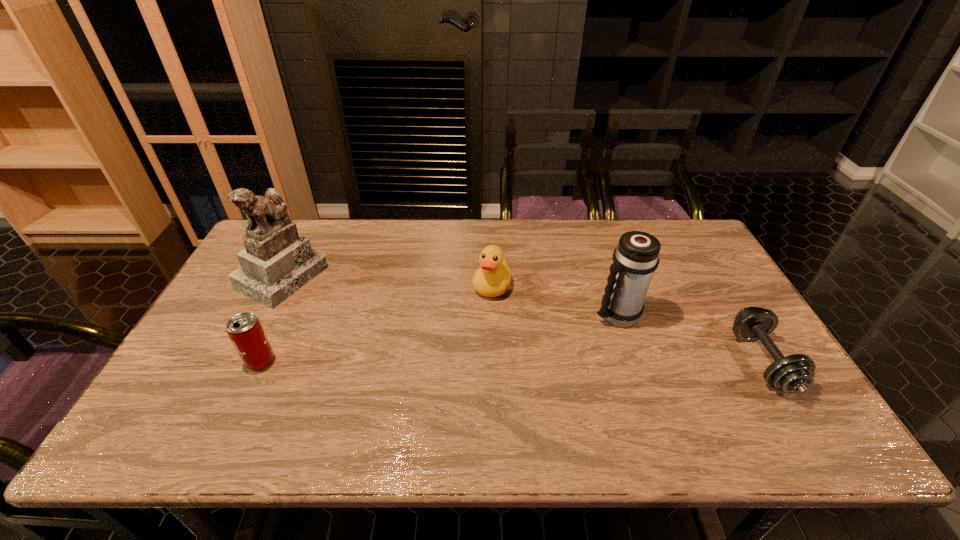
Locate an element on the screen. free location that satisfies the following two spatial constraints: 1. on the front side of the figurine; 2. on the left side of the shortest object is located at coordinates (239, 361).

At what (x,y) coordinates should I click in order to perform the action: click on blank area in the image that satisfies the following two spatial constraints: 1. on the front side of the beer can; 2. on the left side of the dumbbell. Please return your answer as a coordinate pair (x, y). The height and width of the screenshot is (540, 960). Looking at the image, I should click on (260, 361).

Image resolution: width=960 pixels, height=540 pixels. In order to click on blank area in the image that satisfies the following two spatial constraints: 1. on the front side of the tallest object; 2. on the left side of the thermos bottle in this screenshot , I will do `click(263, 315)`.

Identify the location of vacant area in the image that satisfies the following two spatial constraints: 1. on the front side of the fourth shortest object; 2. on the right side of the figurine. (263, 315).

Locate an element on the screen. vacant region that satisfies the following two spatial constraints: 1. on the front side of the tallest object; 2. on the right side of the second object from right to left is located at coordinates (263, 315).

Locate an element on the screen. Image resolution: width=960 pixels, height=540 pixels. free spot that satisfies the following two spatial constraints: 1. on the front side of the third object from left to right; 2. on the right side of the thermos bottle is located at coordinates (492, 315).

You are a GUI agent. You are given a task and a screenshot of the screen. Output one action in this format:
    pyautogui.click(x=<x>, y=<y>)
    Task: Click on the blank area in the image that satisfies the following two spatial constraints: 1. on the front side of the third object from right to left; 2. on the right side of the tallest object
    This screenshot has height=540, width=960.
    Given the screenshot: What is the action you would take?
    pyautogui.click(x=278, y=286)